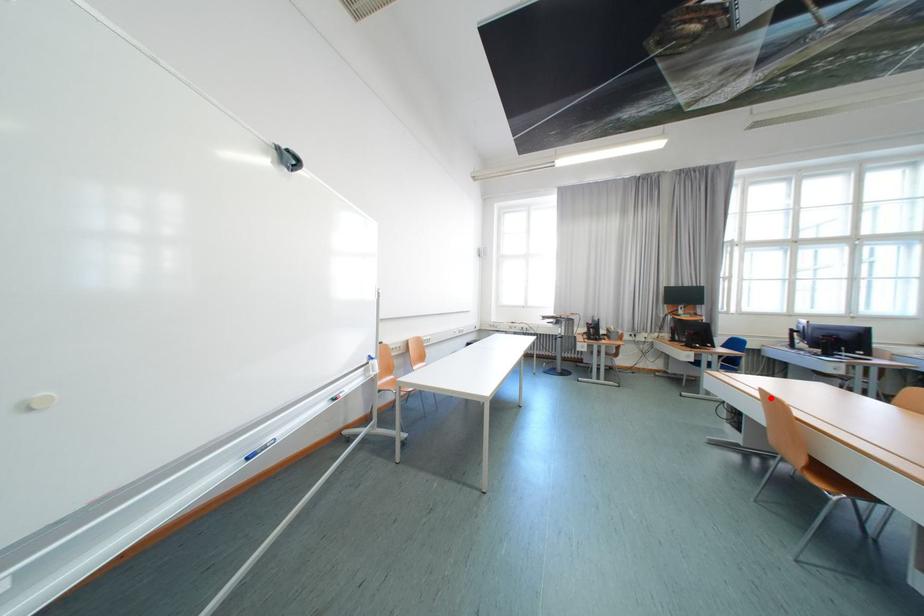
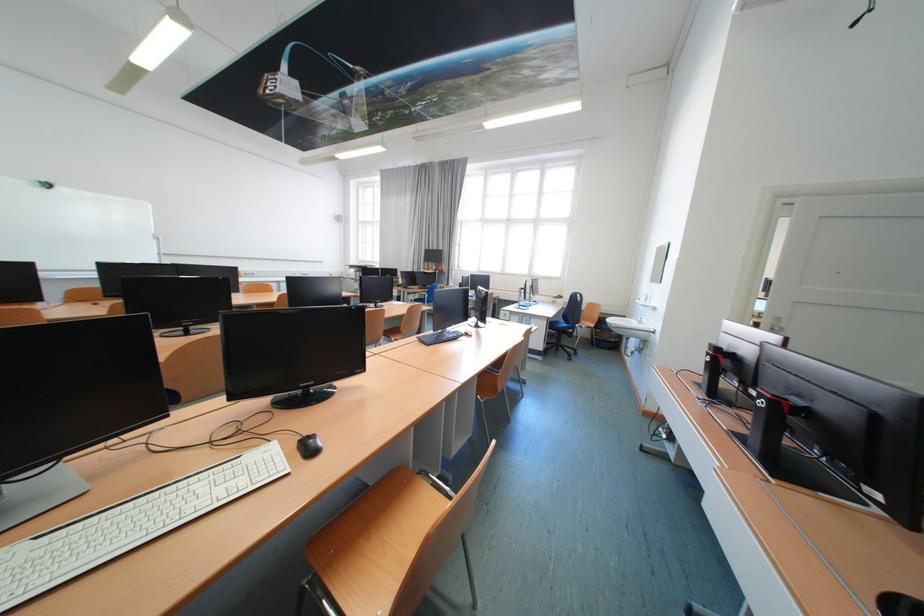
Question: I am providing you with two images of the same scene from different viewpoints. A red point is marked on the first image. At the location where the point appears in image 1, is it still visible in image 2?

Choices:
 (A) Yes
 (B) No

Answer: (B)